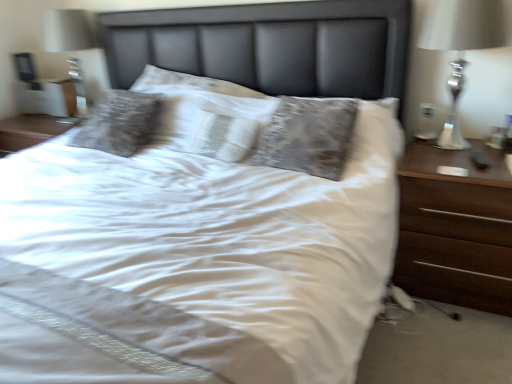
Question: From the image's perspective, does silver metallic lamp at right appear lower than dark wood nightstand at right?

Choices:
 (A) no
 (B) yes

Answer: (A)

Question: Is silver metallic lamp at right completely or partially outside of dark wood nightstand at right?

Choices:
 (A) no
 (B) yes

Answer: (B)

Question: Considering the relative sizes of silver metallic lamp at right and dark wood nightstand at right in the image provided, is silver metallic lamp at right bigger than dark wood nightstand at right?

Choices:
 (A) no
 (B) yes

Answer: (A)

Question: Considering the relative positions of silver metallic lamp at right and dark wood nightstand at right in the image provided, is silver metallic lamp at right to the right of dark wood nightstand at right from the viewer's perspective?

Choices:
 (A) yes
 (B) no

Answer: (B)

Question: Is silver metallic lamp at right in front of dark wood nightstand at right?

Choices:
 (A) yes
 (B) no

Answer: (B)

Question: Is silver metallic lamp at right thinner than dark wood nightstand at right?

Choices:
 (A) yes
 (B) no

Answer: (A)

Question: Does dark wood nightstand at right lie in front of silver metallic lamp at right?

Choices:
 (A) yes
 (B) no

Answer: (A)

Question: Does dark wood nightstand at right have a lesser height compared to silver metallic lamp at right?

Choices:
 (A) no
 (B) yes

Answer: (B)

Question: Can you confirm if dark wood nightstand at right is smaller than silver metallic lamp at right?

Choices:
 (A) yes
 (B) no

Answer: (B)

Question: From a real-world perspective, is dark wood nightstand at right located higher than silver metallic lamp at right?

Choices:
 (A) no
 (B) yes

Answer: (A)

Question: Is dark wood nightstand at right outside silver metallic lamp at right?

Choices:
 (A) no
 (B) yes

Answer: (B)

Question: Is dark wood nightstand at right at the left side of silver metallic lamp at right?

Choices:
 (A) yes
 (B) no

Answer: (B)

Question: Would you say white textured pillow at center is part of silver metallic lamp at right's contents?

Choices:
 (A) no
 (B) yes

Answer: (A)